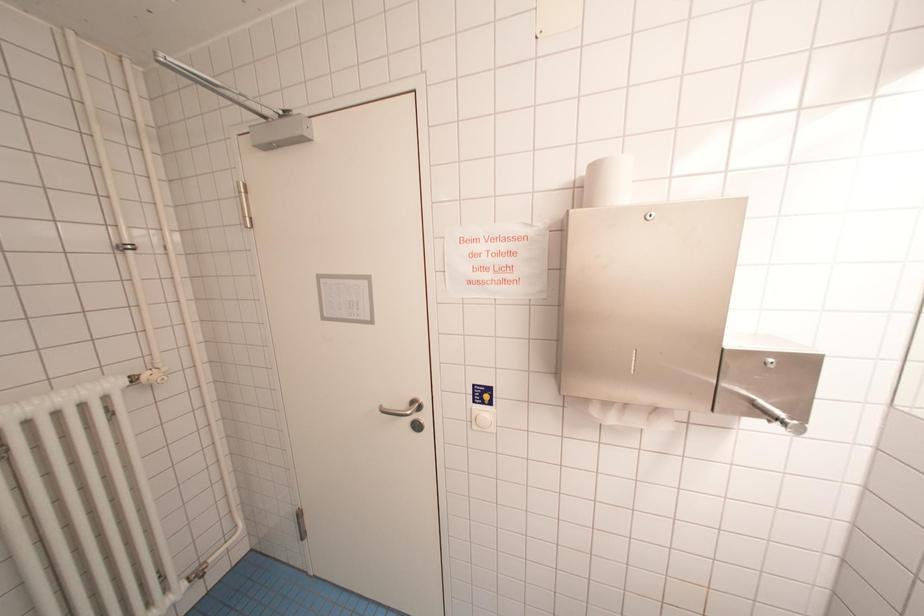
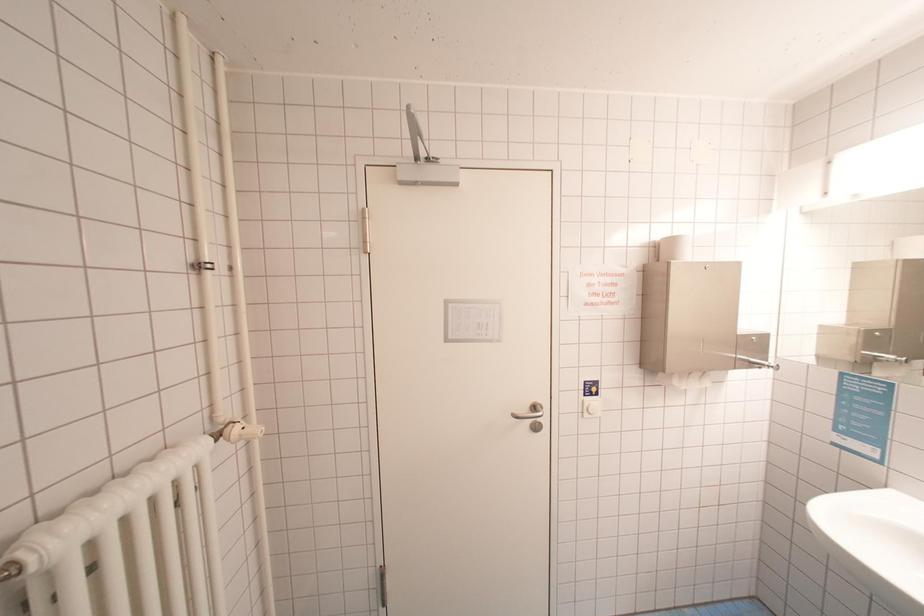
Question: The images are taken continuously from a first-person perspective. In which direction is your viewpoint rotating?

Choices:
 (A) Left
 (B) Right
 (C) Up
 (D) Down

Answer: (B)